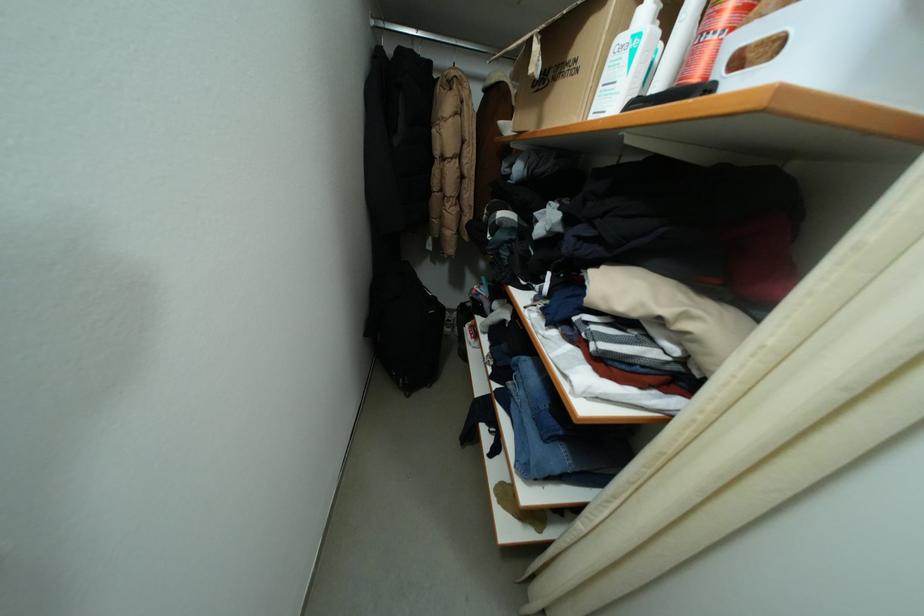
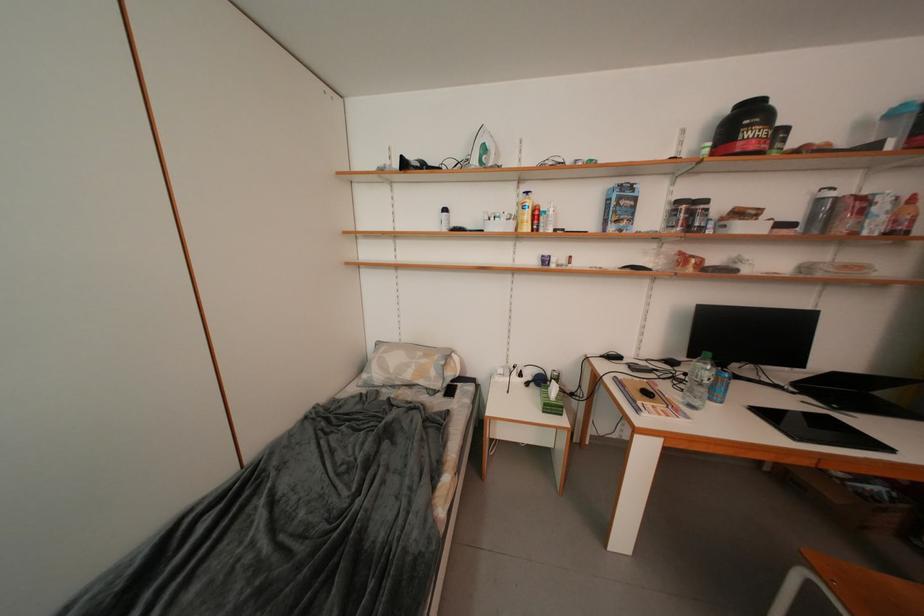
Question: Which direction would the cameraman need to move to produce the second image? Reply with the corresponding letter.

Choices:
 (A) Left
 (B) Right
 (C) Forward
 (D) Backward

Answer: (B)